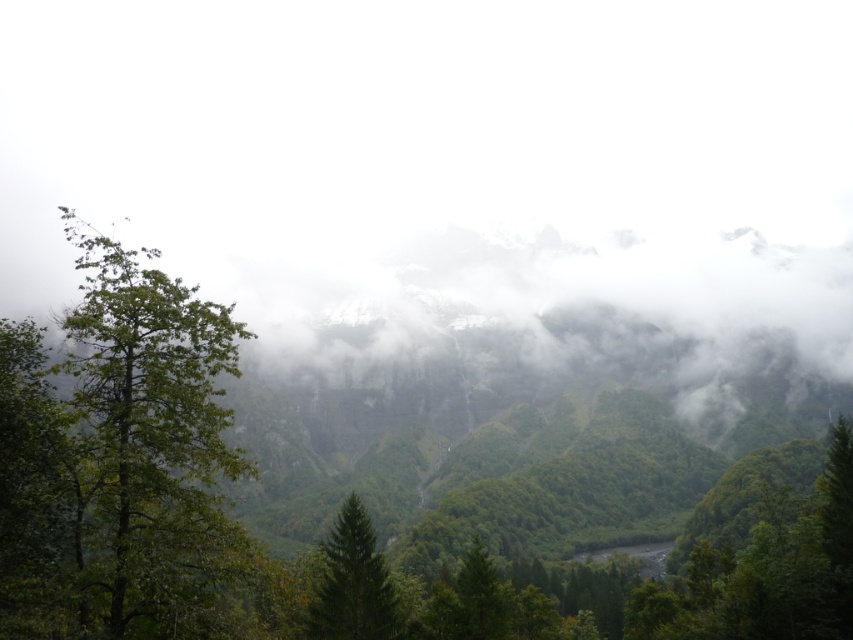
Question: Which object is farther from the camera taking this photo?

Choices:
 (A) green leafy tree at left
 (B) green matte tree at center

Answer: (B)

Question: Can you confirm if green leafy tree at left is positioned to the left of green matte tree at center?

Choices:
 (A) no
 (B) yes

Answer: (B)

Question: Which of the following is the closest to the observer?

Choices:
 (A) green leafy tree at left
 (B) green matte tree at center

Answer: (A)

Question: From the image, what is the correct spatial relationship of green leafy tree at left in relation to green matte tree at center?

Choices:
 (A) below
 (B) above

Answer: (B)

Question: Does green leafy tree at left have a greater width compared to green matte tree at center?

Choices:
 (A) no
 (B) yes

Answer: (B)